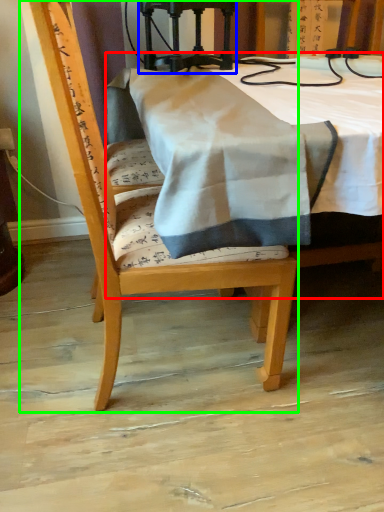
Question: Considering the real-world distances, which object is farthest from table (highlighted by a red box)? equipment (highlighted by a blue box) or chair (highlighted by a green box)?

Choices:
 (A) equipment
 (B) chair

Answer: (B)